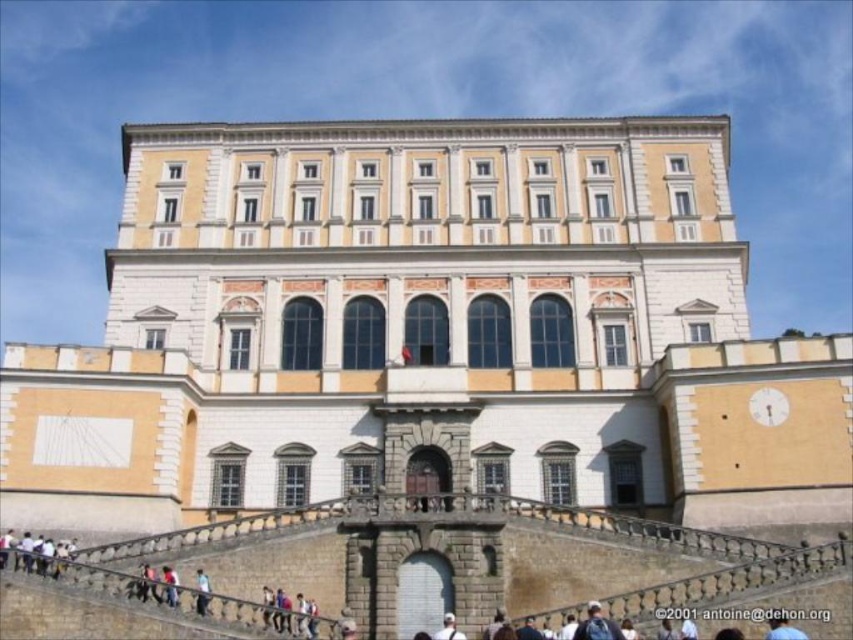
Question: Does blue fabric at center come behind dark blue jeans at center?

Choices:
 (A) no
 (B) yes

Answer: (A)

Question: Which point is farther from the camera taking this photo?

Choices:
 (A) (165, 584)
 (B) (442, 624)
 (C) (198, 570)
 (D) (785, 618)

Answer: (C)

Question: Can you confirm if dark blue jeans at center is positioned below white fabric cap at upper center?

Choices:
 (A) no
 (B) yes

Answer: (A)

Question: Estimate the real-world distances between objects in this image. Which object is closer to the blue fabric at center?

Choices:
 (A) dark blue jeans at center
 (B) light blue jeans at lower center
 (C) white fabric cap at upper center

Answer: (C)

Question: Can you confirm if blue fabric at center is positioned to the left of light blue jeans at lower center?

Choices:
 (A) no
 (B) yes

Answer: (A)

Question: Which is farther from the white fabric cap at upper center?

Choices:
 (A) light blue jeans at lower center
 (B) blue fabric at center

Answer: (B)